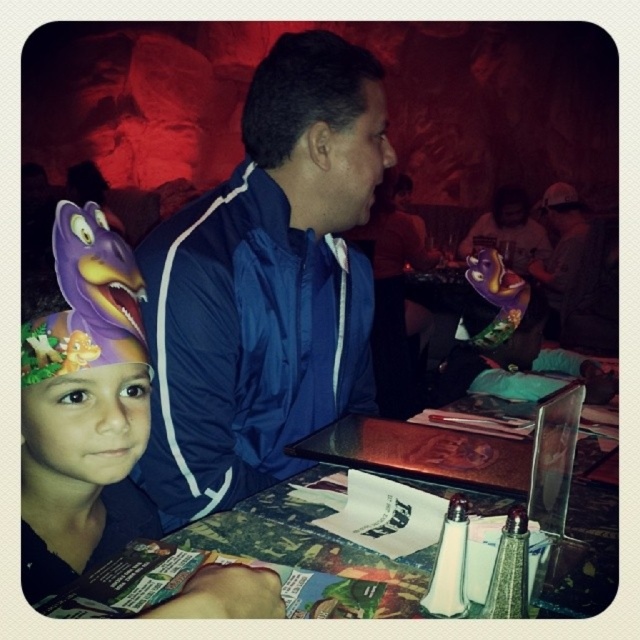
You are a photographer setting up for a group photo in the restaurant. You need to ensure that the blue nylon jacket at center and the purple fabric headband at left are both visible in the frame. Given their sizes, which object might require you to adjust your camera angle to avoid being too dominant in the shot?

The blue nylon jacket at center is larger in size than the purple fabric headband at left, so it might require adjusting the camera angle to prevent it from overshadowing the smaller object.

In the scene described, where is the blue nylon jacket at center located in terms of coordinates?

The blue nylon jacket at center is located at coordinates point (266, 284).

You are standing at the point marked as point (170, 369) in the image. You want to move to the door located behind the table. Can you reach the door without moving past the table?

The point (170, 369) is 37.98 inches away from the viewer. Since the table is between you and the door, you would need to move around the table to reach the door, so you cannot reach the door without moving past the table.